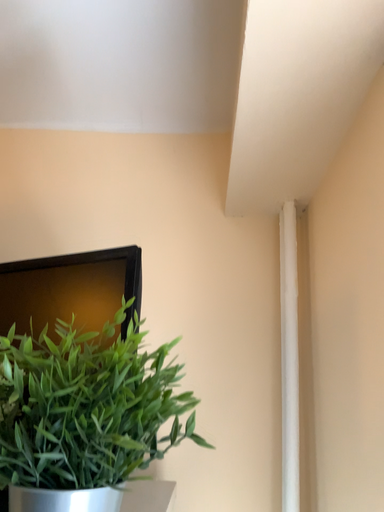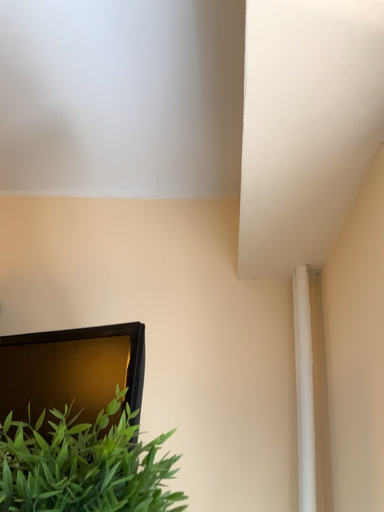
Question: Which way did the camera rotate in the video?

Choices:
 (A) rotated downward
 (B) rotated upward

Answer: (B)